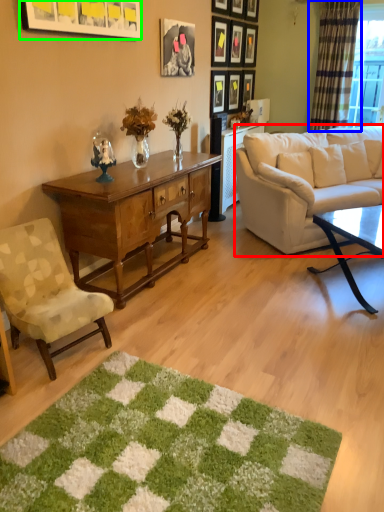
Question: Which object is the closest to the studio couch (highlighted by a red box)? Choose among these: curtain (highlighted by a blue box) or picture frame (highlighted by a green box).

Choices:
 (A) curtain
 (B) picture frame

Answer: (B)